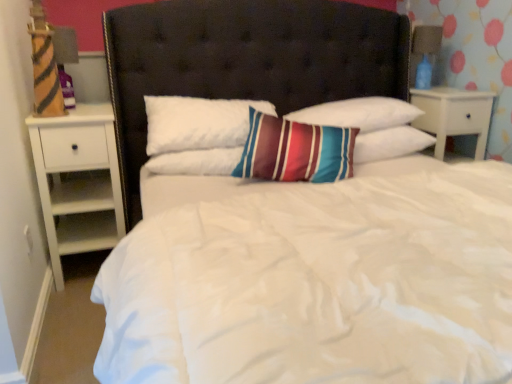
Where is `white wood nightstand at left, positioned as the 1th nightstand in left-to-right order`? The image size is (512, 384). white wood nightstand at left, positioned as the 1th nightstand in left-to-right order is located at coordinates (78, 181).

The image size is (512, 384). What do you see at coordinates (196, 162) in the screenshot?
I see `white soft pillow at center, the first pillow in the left-to-right sequence` at bounding box center [196, 162].

The width and height of the screenshot is (512, 384). What do you see at coordinates (359, 113) in the screenshot? I see `striped fabric pillow at center, the second pillow from the right` at bounding box center [359, 113].

Where is `white wood nightstand at left, positioned as the 1th nightstand in left-to-right order`? white wood nightstand at left, positioned as the 1th nightstand in left-to-right order is located at coordinates (78, 181).

Does white wood nightstand at right, which is counted as the 1th nightstand, starting from the right, have a greater height compared to striped cotton pillow at center, the third pillow when ordered from left to right?

Indeed, white wood nightstand at right, which is counted as the 1th nightstand, starting from the right, has a greater height compared to striped cotton pillow at center, the third pillow when ordered from left to right.

Does point (468, 109) come behind point (395, 129)?

Yes, point (468, 109) is farther from viewer.

Is white wood nightstand at right, which appears as the 2th nightstand when viewed from the left, aimed at striped cotton pillow at center, the first pillow viewed from the right?

No, white wood nightstand at right, which appears as the 2th nightstand when viewed from the left, is not turned towards striped cotton pillow at center, the first pillow viewed from the right.

From the image's perspective, is white wood nightstand at right, which appears as the 2th nightstand when viewed from the left, below striped cotton pillow at center, the first pillow viewed from the right?

No, from the image's perspective, white wood nightstand at right, which appears as the 2th nightstand when viewed from the left, is not below striped cotton pillow at center, the first pillow viewed from the right.

Between white wood nightstand at right, which appears as the 2th nightstand when viewed from the left, and white wood nightstand at left, positioned as the 1th nightstand in left-to-right order, which one has smaller size?

white wood nightstand at right, which appears as the 2th nightstand when viewed from the left.

Can you confirm if white wood nightstand at right, which is counted as the 1th nightstand, starting from the right, is wider than white wood nightstand at left, which ranks as the second nightstand in right-to-left order?

In fact, white wood nightstand at right, which is counted as the 1th nightstand, starting from the right, might be narrower than white wood nightstand at left, which ranks as the second nightstand in right-to-left order.

Looking at this image, from a real-world perspective, between white wood nightstand at right, which appears as the 2th nightstand when viewed from the left, and white wood nightstand at left, positioned as the 1th nightstand in left-to-right order, who is vertically higher?

white wood nightstand at right, which appears as the 2th nightstand when viewed from the left, from a real-world perspective.

Which point is more forward, (469,121) or (98,204)?

The point (98,204) is more forward.

Considering the sizes of objects white soft pillow at center, the first pillow in the left-to-right sequence, and striped fabric pillow at center, the second pillow from the right, in the image provided, who is smaller, white soft pillow at center, the first pillow in the left-to-right sequence, or striped fabric pillow at center, the second pillow from the right,?

white soft pillow at center, the first pillow in the left-to-right sequence.

Based on their positions, is white soft pillow at center, the first pillow in the left-to-right sequence, located to the left or right of striped fabric pillow at center, which appears as the second pillow when viewed from the left?

white soft pillow at center, the first pillow in the left-to-right sequence, is positioned on striped fabric pillow at center, which appears as the second pillow when viewed from the left,'s left side.

Locate an element on the screen. pillow on the left of striped fabric pillow at center, which appears as the second pillow when viewed from the left is located at coordinates (196, 162).

Would you say white soft pillow at center, which appears as the 3th pillow when viewed from the right, is outside striped fabric pillow at center, the second pillow from the right?

Indeed, white soft pillow at center, which appears as the 3th pillow when viewed from the right, is completely outside striped fabric pillow at center, the second pillow from the right.

Between white soft pillow at center, which appears as the 3th pillow when viewed from the right, and blue glass lamp at upper right, which one has more height?

Standing taller between the two is blue glass lamp at upper right.

Is white soft pillow at center, the first pillow in the left-to-right sequence, situated inside blue glass lamp at upper right or outside?

white soft pillow at center, the first pillow in the left-to-right sequence, cannot be found inside blue glass lamp at upper right.

From a real-world perspective, who is located higher, white soft pillow at center, the first pillow in the left-to-right sequence, or blue glass lamp at upper right?

blue glass lamp at upper right, from a real-world perspective.

From the image's perspective, is white soft pillow at center, the first pillow in the left-to-right sequence, over blue glass lamp at upper right?

No.

Considering the positions of objects blue glass lamp at upper right and white soft pillow at center, which appears as the 3th pillow when viewed from the right, in the image provided, who is more to the left, blue glass lamp at upper right or white soft pillow at center, which appears as the 3th pillow when viewed from the right,?

From the viewer's perspective, white soft pillow at center, which appears as the 3th pillow when viewed from the right, appears more on the left side.

Can you confirm if blue glass lamp at upper right is bigger than white soft pillow at center, the first pillow in the left-to-right sequence?

Incorrect, blue glass lamp at upper right is not larger than white soft pillow at center, the first pillow in the left-to-right sequence.

Is blue glass lamp at upper right surrounding white soft pillow at center, the first pillow in the left-to-right sequence?

That's incorrect, white soft pillow at center, the first pillow in the left-to-right sequence, is not inside blue glass lamp at upper right.

Considering the relative sizes of blue glass lamp at upper right and white soft pillow at center, the first pillow in the left-to-right sequence, in the image provided, is blue glass lamp at upper right wider than white soft pillow at center, the first pillow in the left-to-right sequence,?

No.

Considering the sizes of white wood nightstand at left, which ranks as the second nightstand in right-to-left order, and striped fabric pillow at center, the second pillow from the right, in the image, is white wood nightstand at left, which ranks as the second nightstand in right-to-left order, wider or thinner than striped fabric pillow at center, the second pillow from the right,?

Considering their sizes, white wood nightstand at left, which ranks as the second nightstand in right-to-left order, looks broader than striped fabric pillow at center, the second pillow from the right.

Which object is closer to the camera taking this photo, white wood nightstand at left, which ranks as the second nightstand in right-to-left order, or striped fabric pillow at center, the second pillow from the right?

white wood nightstand at left, which ranks as the second nightstand in right-to-left order, is in front.

From a real-world perspective, is white wood nightstand at left, which ranks as the second nightstand in right-to-left order, positioned above or below striped fabric pillow at center, the second pillow from the right?

From a real-world perspective, white wood nightstand at left, which ranks as the second nightstand in right-to-left order, is physically below striped fabric pillow at center, the second pillow from the right.

Is white wood nightstand at right, which appears as the 2th nightstand when viewed from the left, looking in the opposite direction of blue glass lamp at upper right?

white wood nightstand at right, which appears as the 2th nightstand when viewed from the left, does not have its back to blue glass lamp at upper right.

Considering the relative sizes of white wood nightstand at right, which is counted as the 1th nightstand, starting from the right, and blue glass lamp at upper right in the image provided, is white wood nightstand at right, which is counted as the 1th nightstand, starting from the right, smaller than blue glass lamp at upper right?

Actually, white wood nightstand at right, which is counted as the 1th nightstand, starting from the right, might be larger than blue glass lamp at upper right.

Does point (432, 128) appear closer or farther from the camera than point (416, 82)?

Point (432, 128) appears to be closer to the viewer than point (416, 82).

From the image's perspective, relative to blue glass lamp at upper right, is white wood nightstand at right, which appears as the 2th nightstand when viewed from the left, above or below?

Based on their image positions, white wood nightstand at right, which appears as the 2th nightstand when viewed from the left, is located beneath blue glass lamp at upper right.

Image resolution: width=512 pixels, height=384 pixels. Identify the location of the 1st nightstand located beneath the striped cotton pillow at center, the first pillow viewed from the right (from a real-world perspective). click(x=454, y=115).

This screenshot has width=512, height=384. Find the location of `nightstand lying in front of the white wood nightstand at right, which appears as the 2th nightstand when viewed from the left`. nightstand lying in front of the white wood nightstand at right, which appears as the 2th nightstand when viewed from the left is located at coordinates (78, 181).

Looking at the image, which one is located closer to blue glass lamp at upper right, white wood nightstand at right, which appears as the 2th nightstand when viewed from the left, or striped fabric pillow at center, which appears as the second pillow when viewed from the left?

white wood nightstand at right, which appears as the 2th nightstand when viewed from the left, is closer to blue glass lamp at upper right.

Based on their spatial positions, is white soft pillow at center, the first pillow in the left-to-right sequence, or striped fabric pillow at center, which appears as the second pillow when viewed from the left, closer to white wood nightstand at right, which is counted as the 1th nightstand, starting from the right?

Among the two, striped fabric pillow at center, which appears as the second pillow when viewed from the left, is located nearer to white wood nightstand at right, which is counted as the 1th nightstand, starting from the right.

Based on their spatial positions, is blue glass lamp at upper right or white soft pillow at center, which appears as the 3th pillow when viewed from the right, further from white wood nightstand at left, which ranks as the second nightstand in right-to-left order?

Among the two, blue glass lamp at upper right is located further to white wood nightstand at left, which ranks as the second nightstand in right-to-left order.

From the image, which object appears to be farther from white soft pillow at center, the first pillow in the left-to-right sequence, striped cotton pillow at center, the third pillow when ordered from left to right, or striped fabric pillow at center, which appears as the second pillow when viewed from the left?

striped cotton pillow at center, the third pillow when ordered from left to right, is positioned further to the anchor white soft pillow at center, the first pillow in the left-to-right sequence.

When comparing their distances from white wood nightstand at left, which ranks as the second nightstand in right-to-left order, does striped fabric pillow at center, which appears as the second pillow when viewed from the left, or white soft pillow at center, the first pillow in the left-to-right sequence, seem closer?

The object closer to white wood nightstand at left, which ranks as the second nightstand in right-to-left order, is white soft pillow at center, the first pillow in the left-to-right sequence.

From the image, which object appears to be farther from striped cotton pillow at center, the third pillow when ordered from left to right, white wood nightstand at right, which is counted as the 1th nightstand, starting from the right, or white soft pillow at center, which appears as the 3th pillow when viewed from the right?

white soft pillow at center, which appears as the 3th pillow when viewed from the right, is further to striped cotton pillow at center, the third pillow when ordered from left to right.

Looking at the image, which one is located further to white wood nightstand at right, which is counted as the 1th nightstand, starting from the right, striped cotton pillow at center, the third pillow when ordered from left to right, or white wood nightstand at left, which ranks as the second nightstand in right-to-left order?

white wood nightstand at left, which ranks as the second nightstand in right-to-left order, lies further to white wood nightstand at right, which is counted as the 1th nightstand, starting from the right, than the other object.

Looking at the image, which one is located further to white soft pillow at center, which appears as the 3th pillow when viewed from the right, striped cotton pillow at center, the third pillow when ordered from left to right, or white wood nightstand at left, which ranks as the second nightstand in right-to-left order?

Among the two, striped cotton pillow at center, the third pillow when ordered from left to right, is located further to white soft pillow at center, which appears as the 3th pillow when viewed from the right.

Where is `lamp situated between white wood nightstand at left, which ranks as the second nightstand in right-to-left order, and white wood nightstand at right, which is counted as the 1th nightstand, starting from the right, from left to right`? Image resolution: width=512 pixels, height=384 pixels. lamp situated between white wood nightstand at left, which ranks as the second nightstand in right-to-left order, and white wood nightstand at right, which is counted as the 1th nightstand, starting from the right, from left to right is located at coordinates [x=424, y=53].

Find the location of a particular element. lamp situated between white soft pillow at center, which appears as the 3th pillow when viewed from the right, and white wood nightstand at right, which is counted as the 1th nightstand, starting from the right, from left to right is located at coordinates (424, 53).

Where is `pillow between white soft pillow at center, the first pillow in the left-to-right sequence, and striped cotton pillow at center, the third pillow when ordered from left to right`? pillow between white soft pillow at center, the first pillow in the left-to-right sequence, and striped cotton pillow at center, the third pillow when ordered from left to right is located at coordinates (359, 113).

At what (x,y) coordinates should I click in order to perform the action: click on pillow between striped fabric pillow at center, which appears as the second pillow when viewed from the left, and white wood nightstand at right, which is counted as the 1th nightstand, starting from the right, from left to right. Please return your answer as a coordinate pair (x, y). The width and height of the screenshot is (512, 384). Looking at the image, I should click on (390, 144).